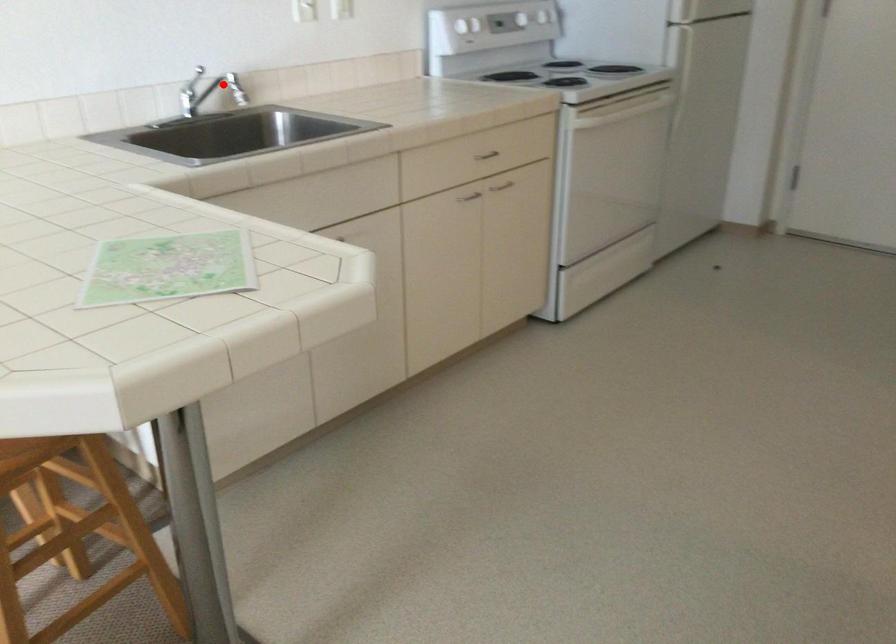
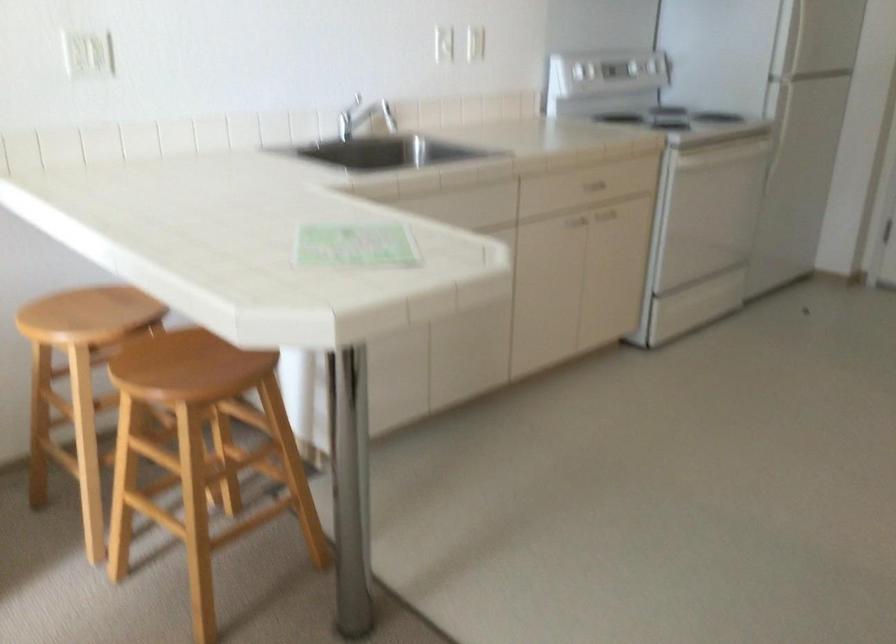
Locate, in the second image, the point that corresponds to the highlighted location in the first image.

(375, 111)